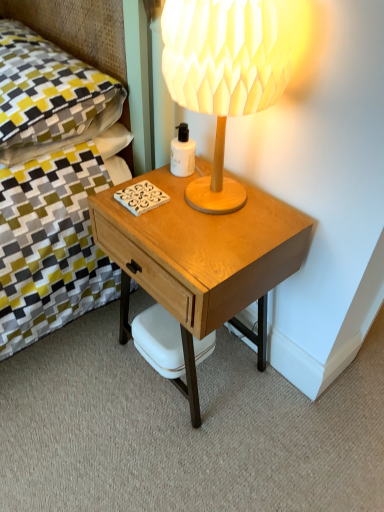
Where is `vacant area that lies to the right of light brown wood desk at center`? vacant area that lies to the right of light brown wood desk at center is located at coordinates (316, 412).